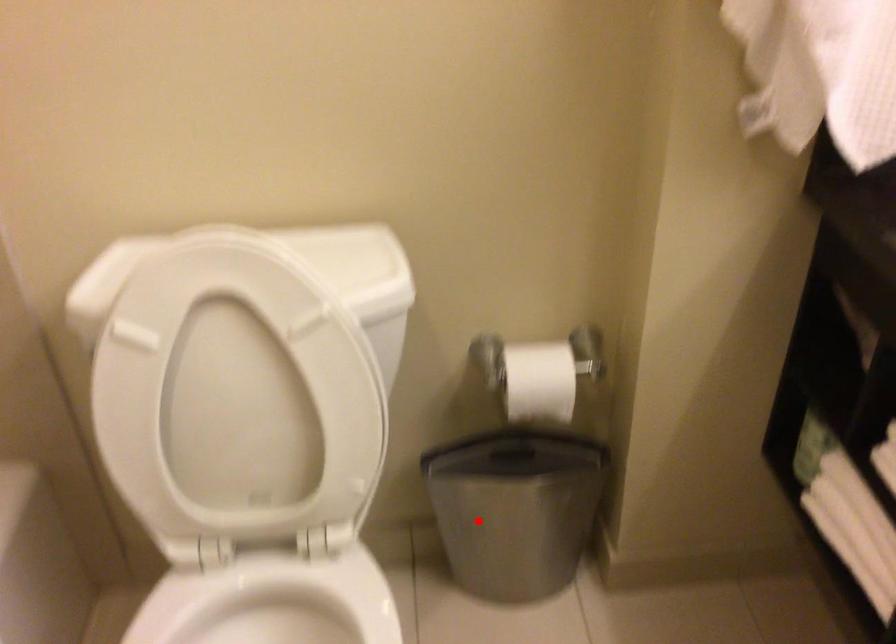
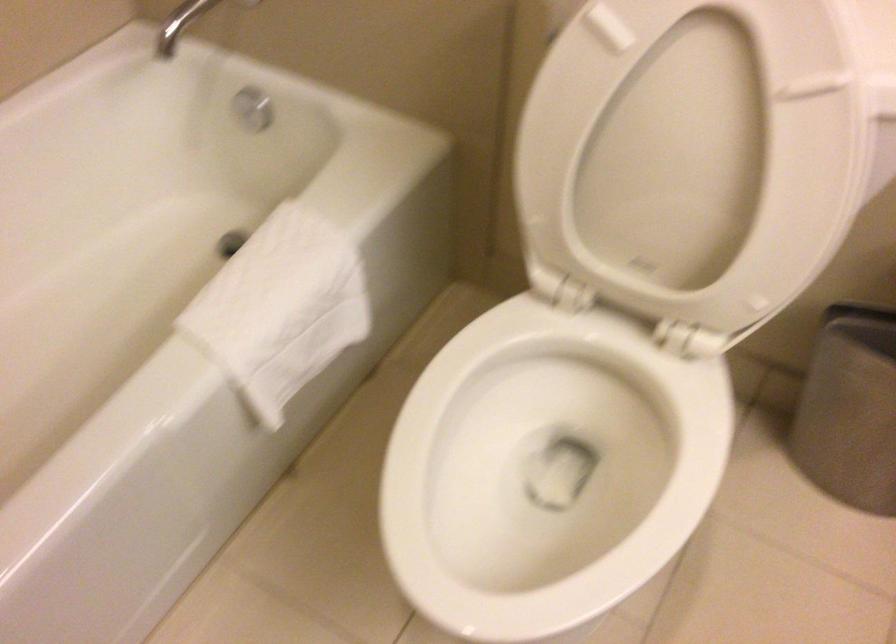
Question: A red point is marked in image1. In image2, is the corresponding 3D point closer to the camera or farther? Reply with the corresponding letter.

Choices:
 (A) The corresponding 3D point is closer.
 (B) The corresponding 3D point is farther.

Answer: (A)